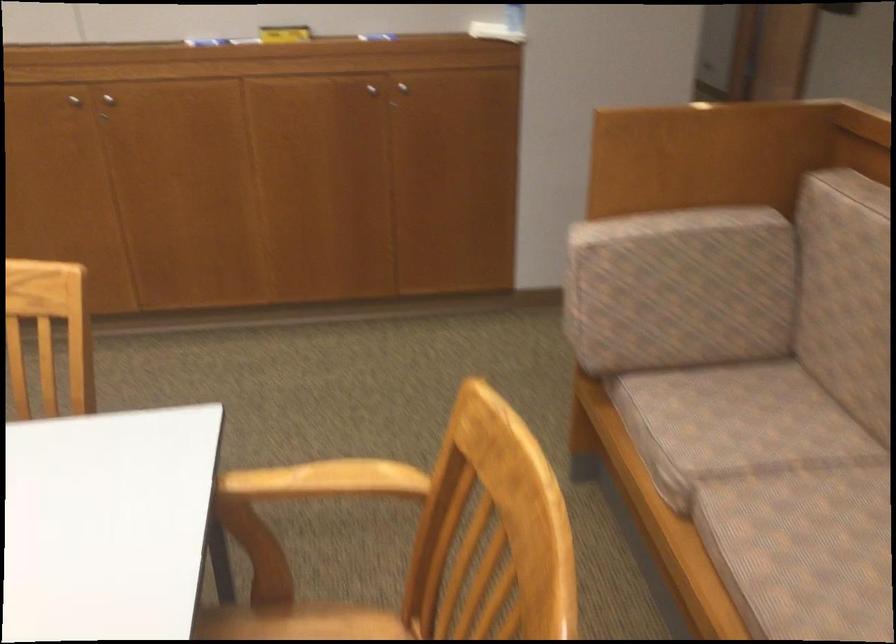
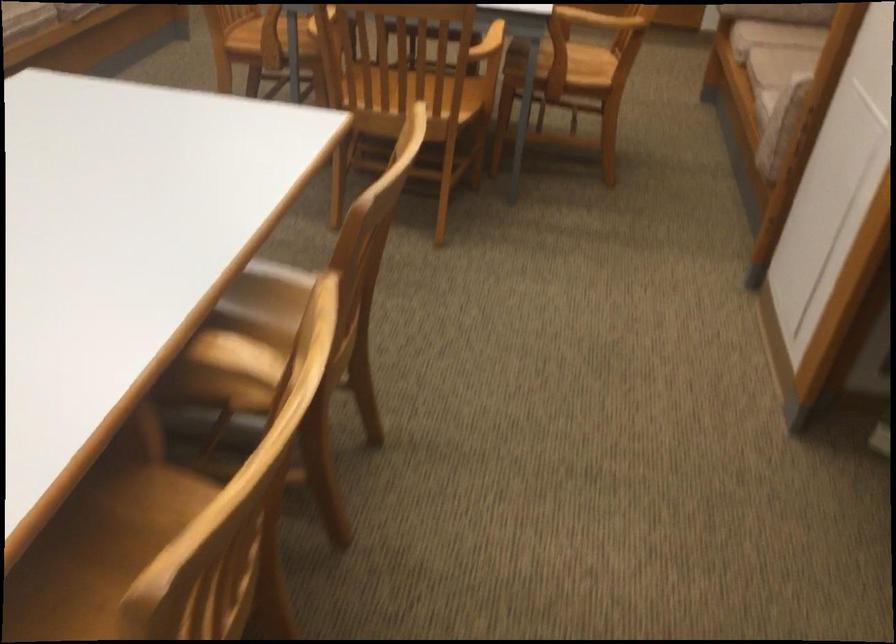
Where in the second image is the point corresponding to (744,462) from the first image?

(782, 33)